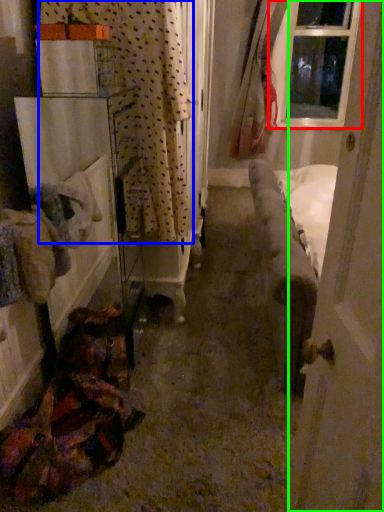
Question: Which object is the farthest from window (highlighted by a red box)? Choose among these: curtain (highlighted by a blue box) or door (highlighted by a green box).

Choices:
 (A) curtain
 (B) door

Answer: (B)